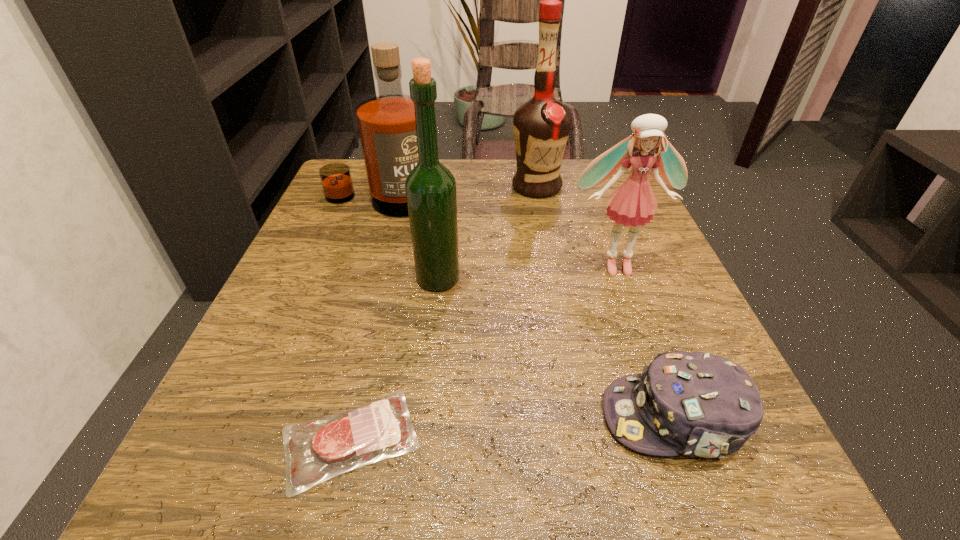
Identify the location of vacant space located 0.230m on the front-facing side of the fifth tallest object. (426, 417).

The image size is (960, 540). What are the coordinates of `vacant region located 0.100m on the right of the shortest object` in the screenshot? It's located at (501, 439).

This screenshot has width=960, height=540. What are the coordinates of `headwear positioned at the near edge` in the screenshot? It's located at (699, 404).

You are a GUI agent. You are given a task and a screenshot of the screen. Output one action in this format:
    pyautogui.click(x=<x>, y=<y>)
    Task: Click on the steak located at the near edge
    This screenshot has height=540, width=960.
    Given the screenshot: What is the action you would take?
    coord(315,451)

Locate an element on the screen. liquor situated at the left edge is located at coordinates (386, 123).

Locate an element on the screen. steak that is at the left edge is located at coordinates (315, 451).

This screenshot has height=540, width=960. I want to click on liquor that is at the right edge, so click(541, 126).

Locate an element on the screen. doll situated at the right edge is located at coordinates (633, 203).

I want to click on headwear positioned at the right edge, so click(x=699, y=404).

Where is `object situated at the far left corner`? The height and width of the screenshot is (540, 960). object situated at the far left corner is located at coordinates (386, 123).